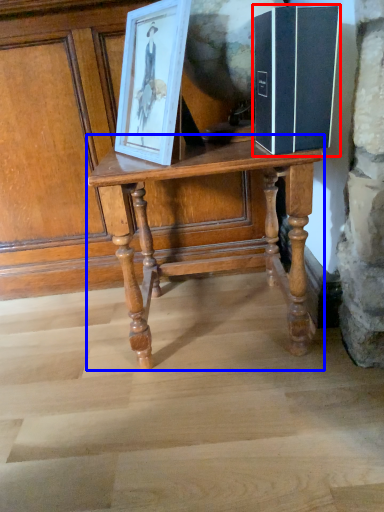
Question: Which point is closer to the camera, book (highlighted by a red box) or table (highlighted by a blue box)?

Choices:
 (A) book
 (B) table

Answer: (A)